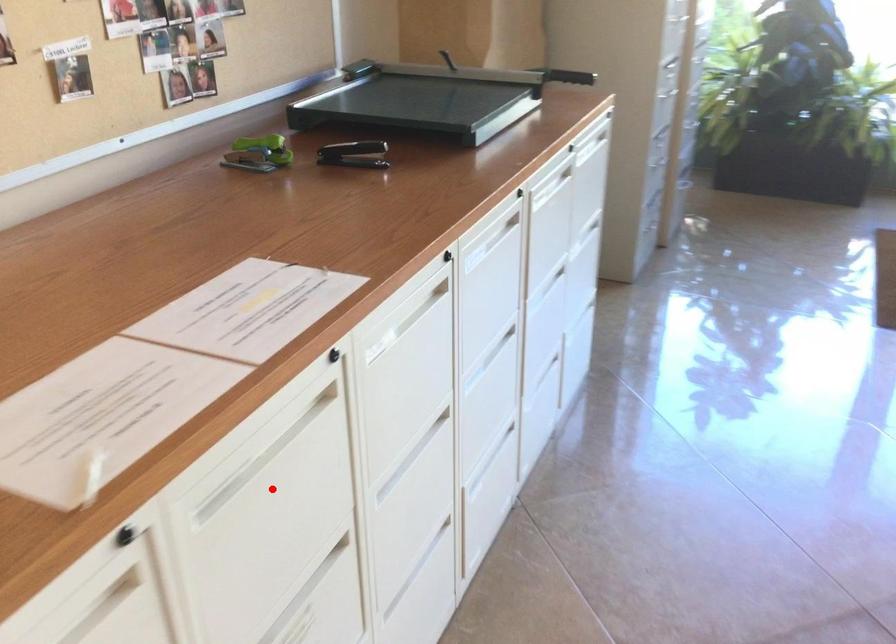
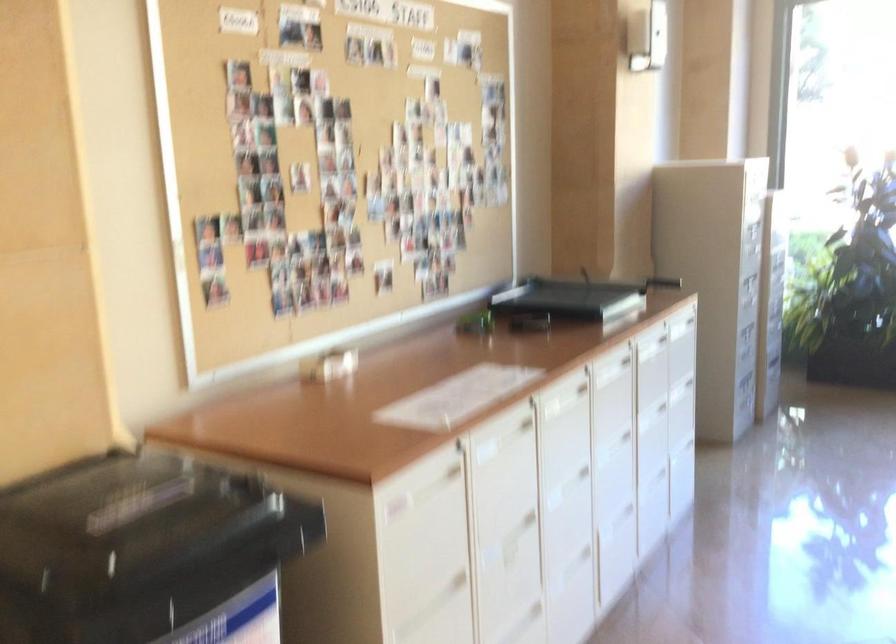
Question: I am providing you with two images of the same scene from different viewpoints. Image1 has a red point marked. In image2, the corresponding 3D location appears at what relative position? Reply with the corresponding letter.

Choices:
 (A) Closer
 (B) Farther

Answer: (B)